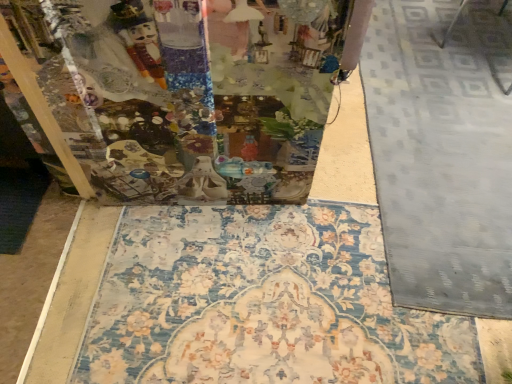
Question: From a real-world perspective, is floral carpet at center positioned above or below gray textured rug at right?

Choices:
 (A) below
 (B) above

Answer: (A)

Question: Would you say floral carpet at center is to the left or to the right of gray textured rug at right in the picture?

Choices:
 (A) left
 (B) right

Answer: (A)

Question: From the image's perspective, relative to gray textured rug at right, is floral carpet at center above or below?

Choices:
 (A) above
 (B) below

Answer: (B)

Question: In terms of size, does gray textured rug at right appear bigger or smaller than floral carpet at center?

Choices:
 (A) big
 (B) small

Answer: (A)

Question: Would you say gray textured rug at right is to the left or to the right of floral carpet at center in the picture?

Choices:
 (A) right
 (B) left

Answer: (A)

Question: Is gray textured rug at right wider or thinner than floral carpet at center?

Choices:
 (A) thin
 (B) wide

Answer: (A)

Question: Is gray textured rug at right taller or shorter than floral carpet at center?

Choices:
 (A) tall
 (B) short

Answer: (A)